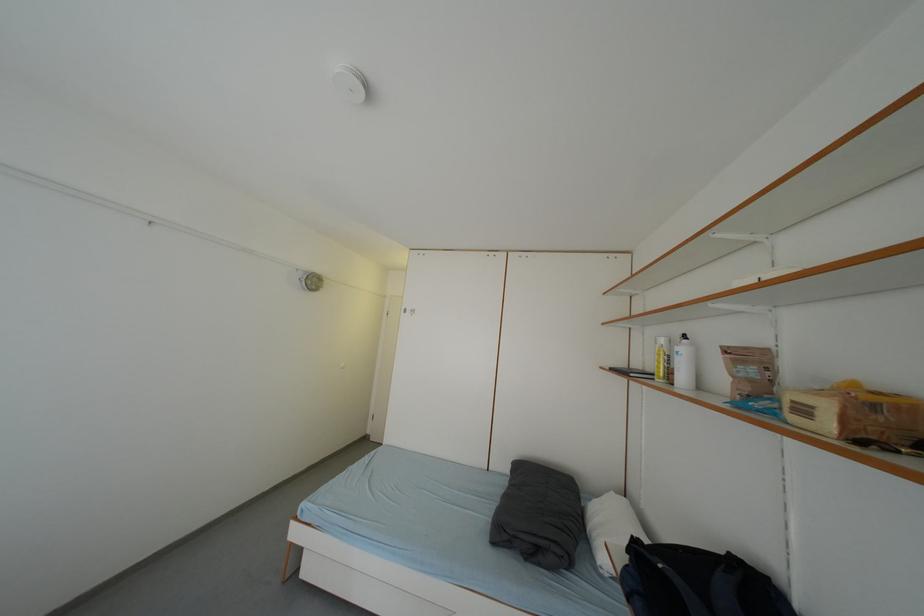
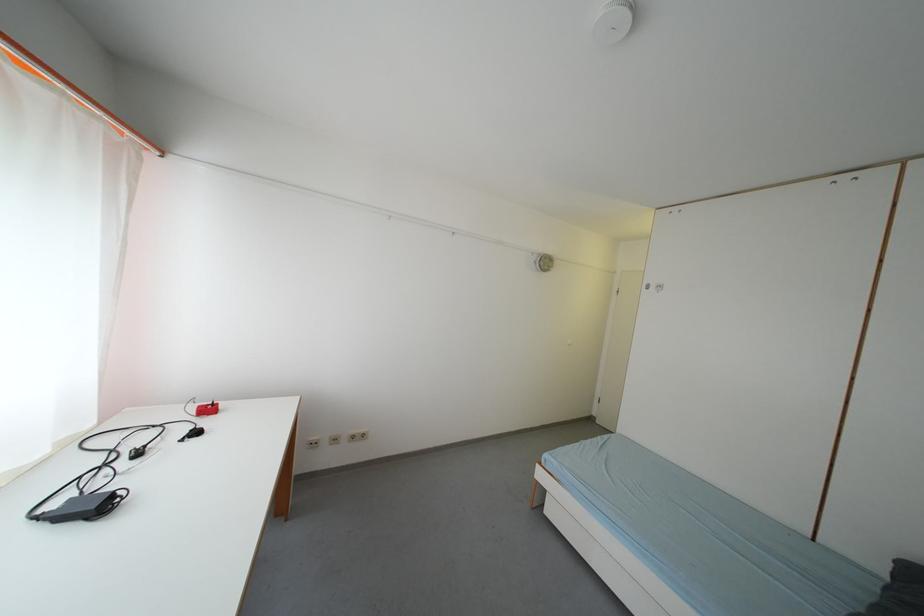
Question: How did the camera likely rotate?

Choices:
 (A) Left
 (B) Right
 (C) Up
 (D) Down

Answer: (A)